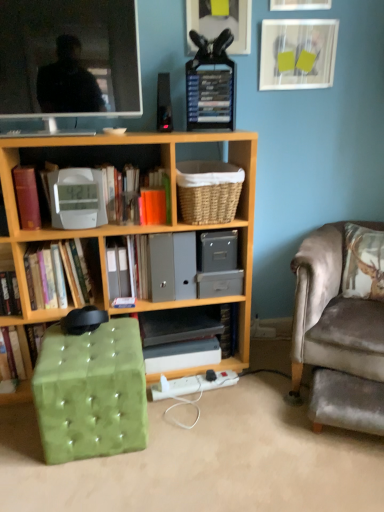
Where is `free location in front of white plastic charger at lower center`? Image resolution: width=384 pixels, height=512 pixels. free location in front of white plastic charger at lower center is located at coordinates (205, 421).